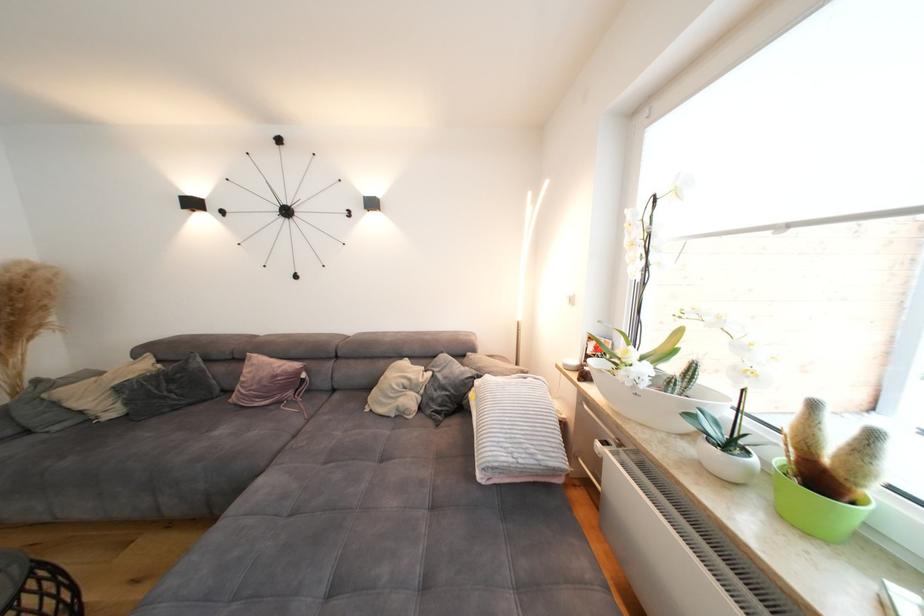
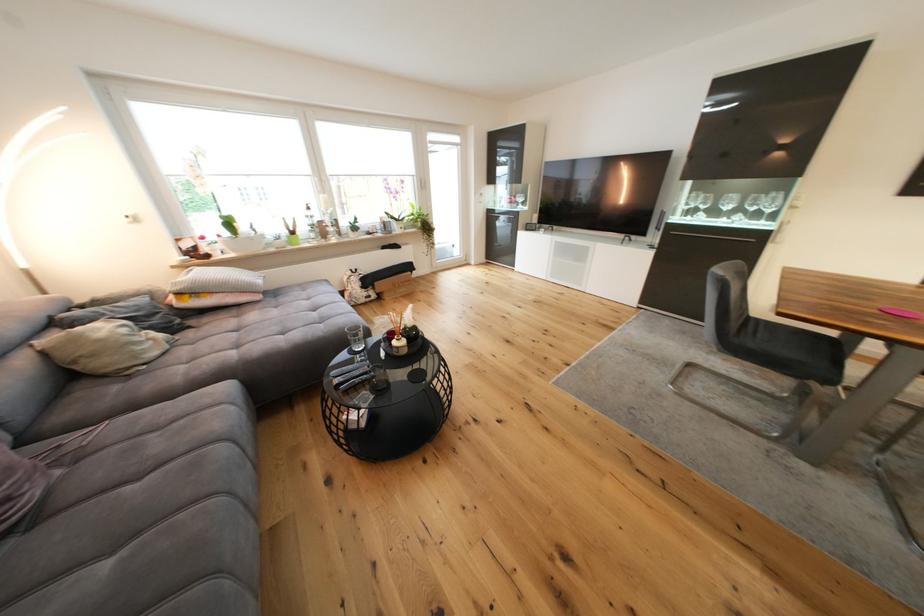
In the second image, find the point that corresponds to pixel 407 418 in the first image.

(178, 345)